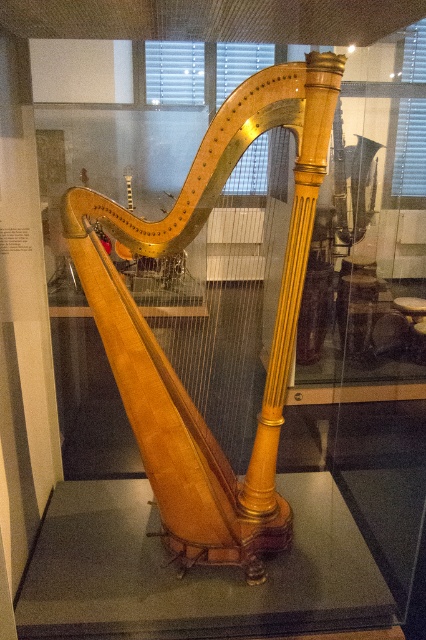
Question: Is wooden harp at center wider than transparent glass table at center?

Choices:
 (A) no
 (B) yes

Answer: (A)

Question: Does wooden harp at center appear under transparent glass table at center?

Choices:
 (A) no
 (B) yes

Answer: (A)

Question: Which object appears farthest from the camera in this image?

Choices:
 (A) transparent glass table at center
 (B) wooden harp at center

Answer: (A)

Question: Among these objects, which one is farthest from the camera?

Choices:
 (A) transparent glass table at center
 (B) wooden harp at center

Answer: (A)

Question: Does wooden harp at center have a greater width compared to transparent glass table at center?

Choices:
 (A) yes
 (B) no

Answer: (B)